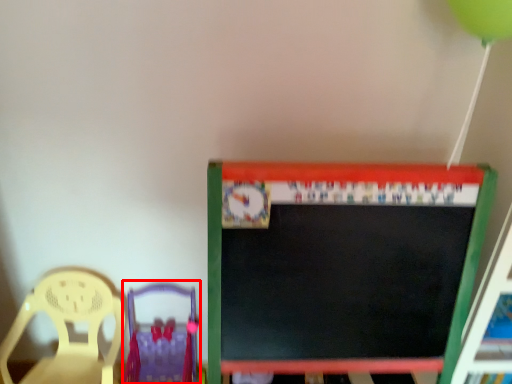
Question: From the image's perspective, what is the correct spatial relationship of chair (annotated by the red box) in relation to chair?

Choices:
 (A) above
 (B) below

Answer: (B)